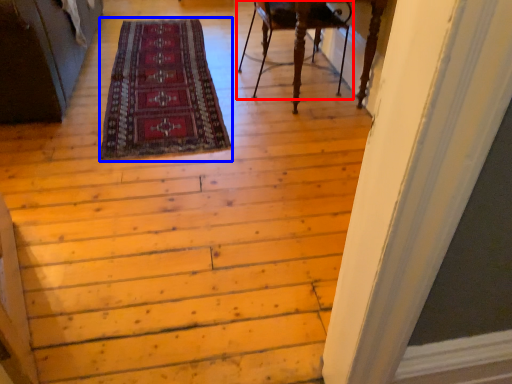
Question: Which point is closer to the camera, chair (highlighted by a red box) or mat (highlighted by a blue box)?

Choices:
 (A) chair
 (B) mat

Answer: (B)